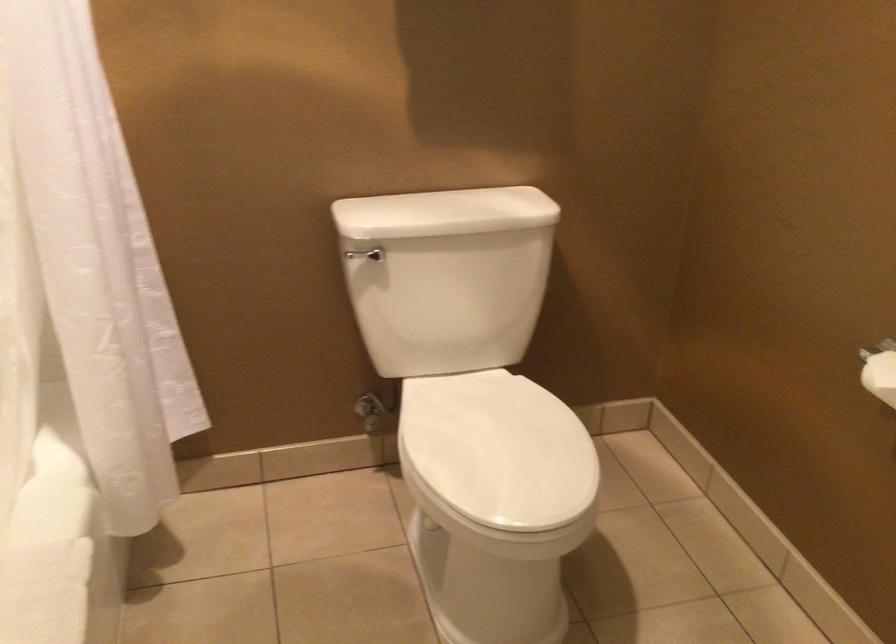
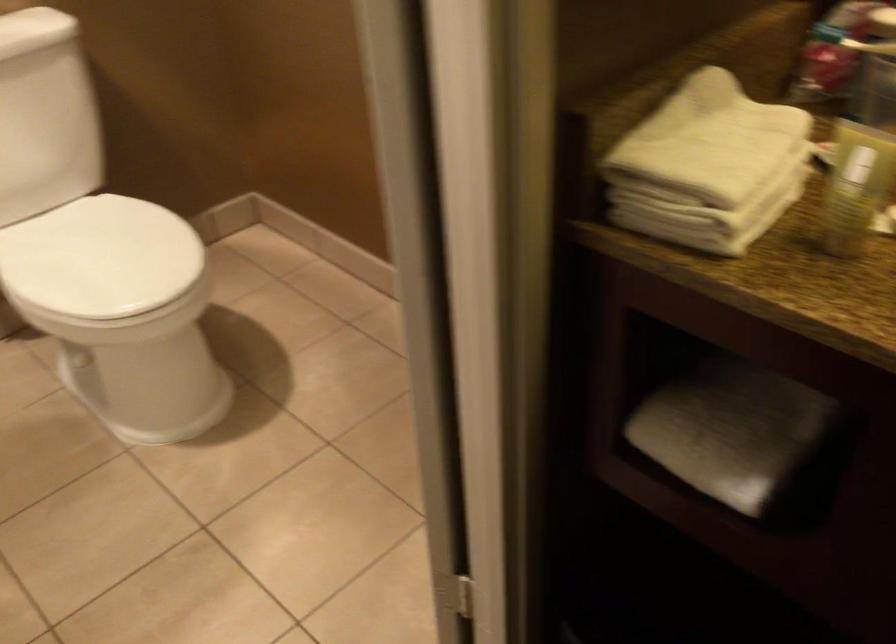
Question: The camera is either moving clockwise (left) or counter-clockwise (right) around the object. The first image is from the beginning of the video and the second image is from the end. Is the camera moving left or right when shooting the video?

Choices:
 (A) Left
 (B) Right

Answer: (A)